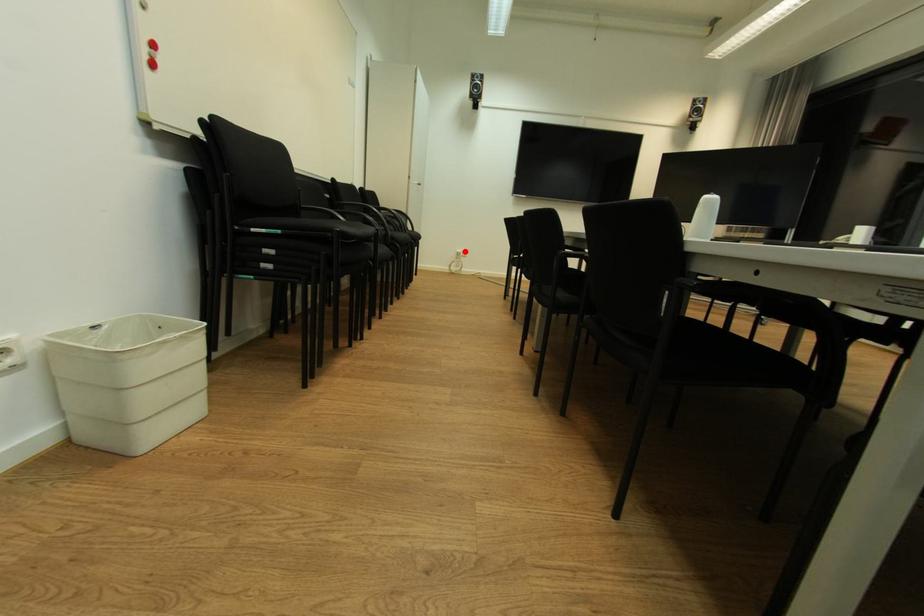
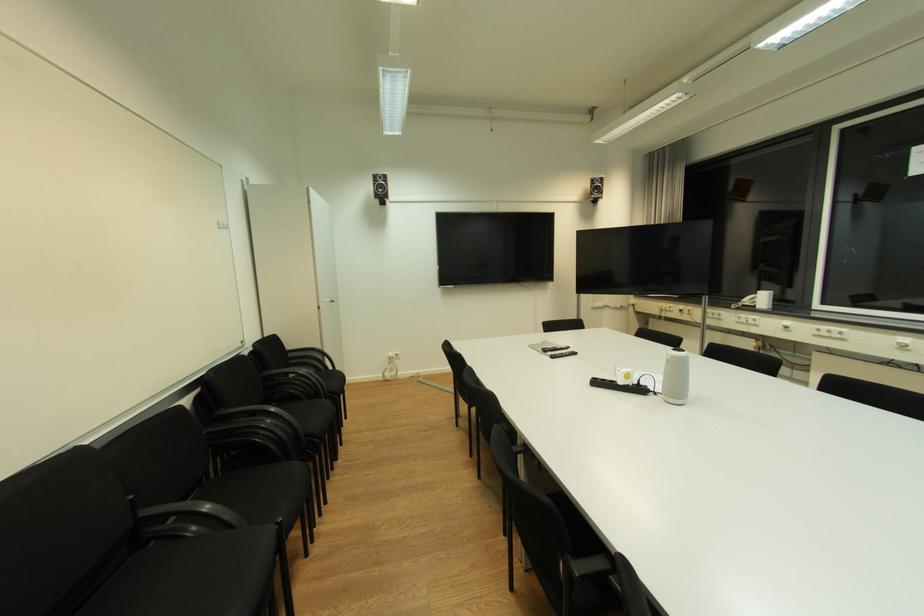
Question: I am providing you with two images of the same scene from different viewpoints. Given a red point in image1, look at the same physical point in image2. Is it:

Choices:
 (A) Closer to the viewpoint
 (B) Farther from the viewpoint

Answer: (B)